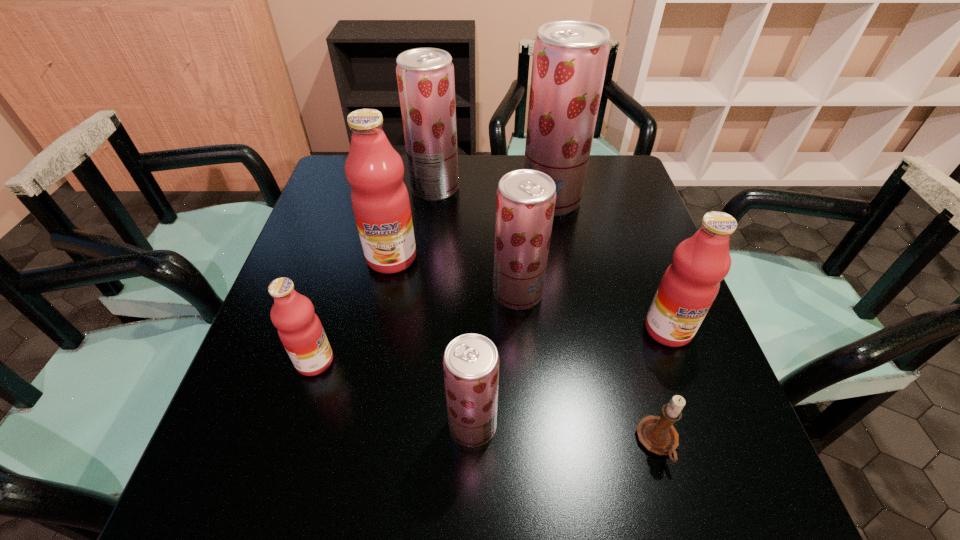
Locate which object is the closest to the tallest fruit juice. Please provide its 2D coordinates. Your answer should be formatted as a tuple, i.e. [(x, y)], where the tuple contains the x and y coordinates of a point satisfying the conditions above.

[(425, 76)]

This screenshot has height=540, width=960. What are the coordinates of `object that stands as the third closest to the second nearest strawberry fruit juice` in the screenshot? It's located at (570, 57).

Locate which fruit juice is the fifth closest to the smallest pink fruit juice. Please provide its 2D coordinates. Your answer should be formatted as a tuple, i.e. [(x, y)], where the tuple contains the x and y coordinates of a point satisfying the conditions above.

[(570, 57)]

Locate which fruit juice is the fifth closest to the leftmost strawberry fruit juice. Please provide its 2D coordinates. Your answer should be formatted as a tuple, i.e. [(x, y)], where the tuple contains the x and y coordinates of a point satisfying the conditions above.

[(689, 286)]

Choose which strawberry fruit juice is the second nearest neighbor to the farthest pink fruit juice. Please provide its 2D coordinates. Your answer should be formatted as a tuple, i.e. [(x, y)], where the tuple contains the x and y coordinates of a point satisfying the conditions above.

[(525, 200)]

Identify the location of strawberry fruit juice that is the nearest to the shortest object. This screenshot has height=540, width=960. (471, 362).

Identify the location of the third closest pink fruit juice to the shortest object. This screenshot has height=540, width=960. (300, 330).

Where is `pink fruit juice that is the closest one to the farthest pink fruit juice`? The width and height of the screenshot is (960, 540). pink fruit juice that is the closest one to the farthest pink fruit juice is located at coordinates (300, 330).

Identify the location of free space that satisfies the following two spatial constraints: 1. on the label of the biggest pink fruit juice; 2. on the label of the smallest pink fruit juice. This screenshot has height=540, width=960. (371, 361).

The width and height of the screenshot is (960, 540). Find the location of `vacant space that satisfies the following two spatial constraints: 1. on the label of the farthest pink fruit juice; 2. on the left side of the fourth object from left to right`. vacant space that satisfies the following two spatial constraints: 1. on the label of the farthest pink fruit juice; 2. on the left side of the fourth object from left to right is located at coordinates (358, 426).